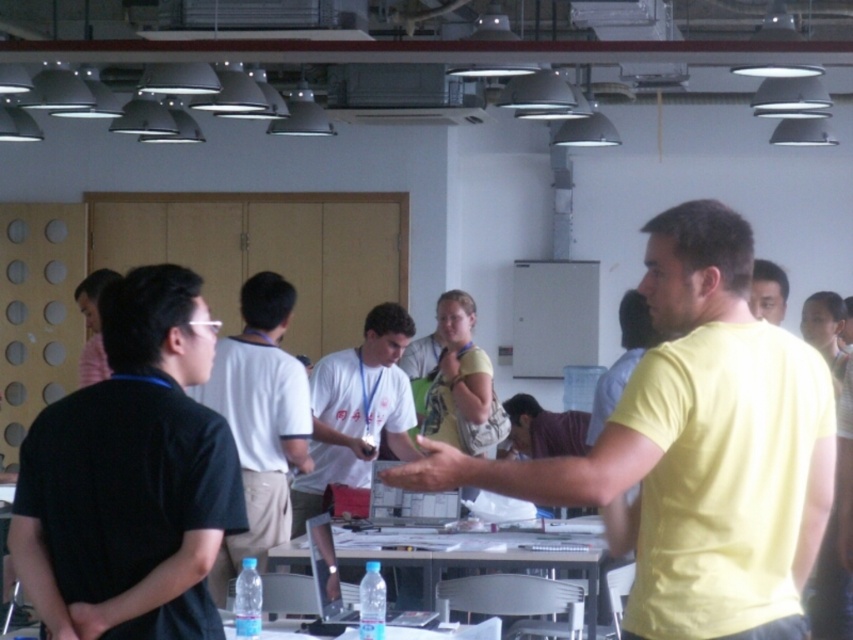
Question: Which object is the farthest from the metallic gray table at center?

Choices:
 (A) matte yellow shirt at center
 (B) black matte shirt at left
 (C) black cotton shirt at center
 (D) yellow matte shirt at center

Answer: (D)

Question: Which point is closer to the camera?

Choices:
 (A) (660, 582)
 (B) (302, 438)
 (C) (350, 445)

Answer: (A)

Question: Is yellow matte shirt at center bigger than black matte shirt at left?

Choices:
 (A) no
 (B) yes

Answer: (B)

Question: Can you confirm if black cotton shirt at center is smaller than metallic gray table at center?

Choices:
 (A) yes
 (B) no

Answer: (B)

Question: Is black matte shirt at left bigger than matte yellow shirt at center?

Choices:
 (A) yes
 (B) no

Answer: (A)

Question: Which of these objects is positioned farthest from the matte yellow shirt at center?

Choices:
 (A) yellow matte shirt at center
 (B) black cotton shirt at center

Answer: (B)